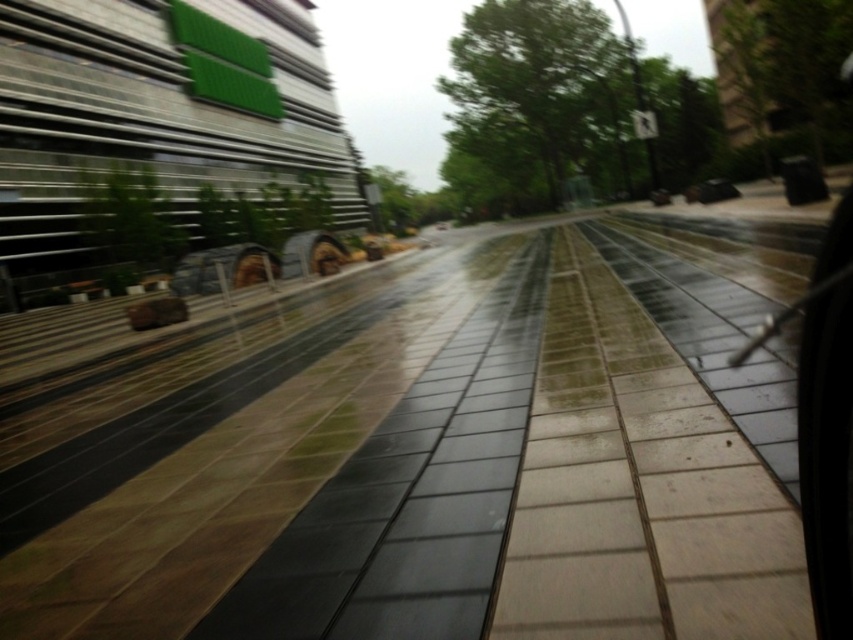
Question: Which point is farther to the camera?

Choices:
 (A) (370, 340)
 (B) (39, 116)

Answer: (B)

Question: Does shiny concrete pavement at center have a larger size compared to green glass passenger train at upper left?

Choices:
 (A) yes
 (B) no

Answer: (B)

Question: Which object appears farthest from the camera in this image?

Choices:
 (A) shiny concrete pavement at center
 (B) green glass passenger train at upper left

Answer: (B)

Question: Considering the relative positions of shiny concrete pavement at center and green glass passenger train at upper left in the image provided, where is shiny concrete pavement at center located with respect to green glass passenger train at upper left?

Choices:
 (A) right
 (B) left

Answer: (A)

Question: Does shiny concrete pavement at center appear under green glass passenger train at upper left?

Choices:
 (A) no
 (B) yes

Answer: (B)